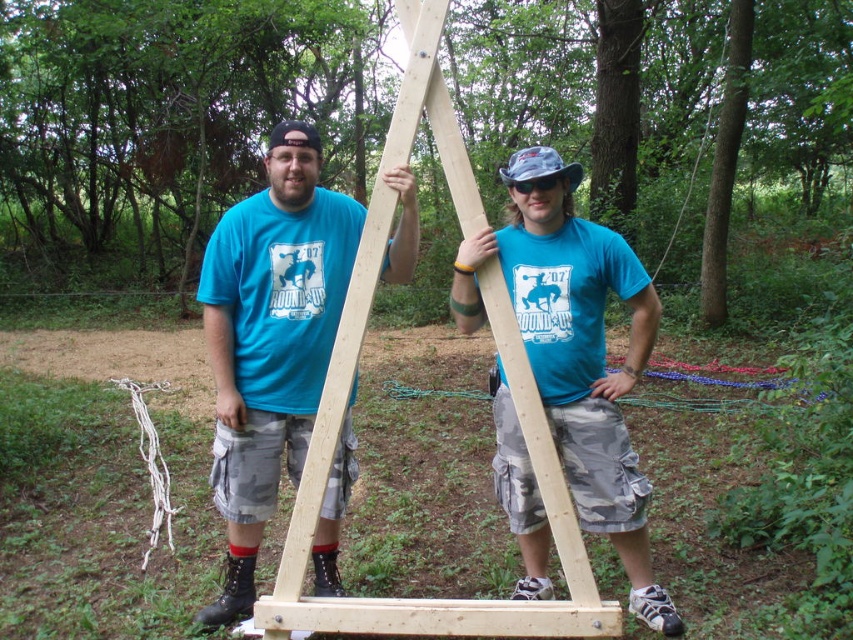
From the picture: Does matte wood frame at center have a smaller size compared to natural wood ladder at center?

Indeed, matte wood frame at center has a smaller size compared to natural wood ladder at center.

Is point (512, 160) positioned in front of point (477, 193)?

No, (512, 160) is further to viewer.

What are the coordinates of `matte wood frame at center` in the screenshot? It's located at (575, 349).

Is matte blue t-shirt at center taller than natural wood ladder at center?

Incorrect, matte blue t-shirt at center's height is not larger of natural wood ladder at center's.

Between point (206, 276) and point (264, 624), which one is positioned behind?

Point (206, 276)

Who is more distant from viewer, [265,237] or [335,394]?

Positioned behind is point [265,237].

Identify the location of matte blue t-shirt at center. (270, 339).

Describe the element at coordinates (270, 339) in the screenshot. I see `matte blue t-shirt at center` at that location.

Is matte blue t-shirt at center above matte wood frame at center?

No.

Is point (283, 320) positioned behind point (527, 262)?

That is True.

Where is `matte blue t-shirt at center`? This screenshot has height=640, width=853. matte blue t-shirt at center is located at coordinates (270, 339).